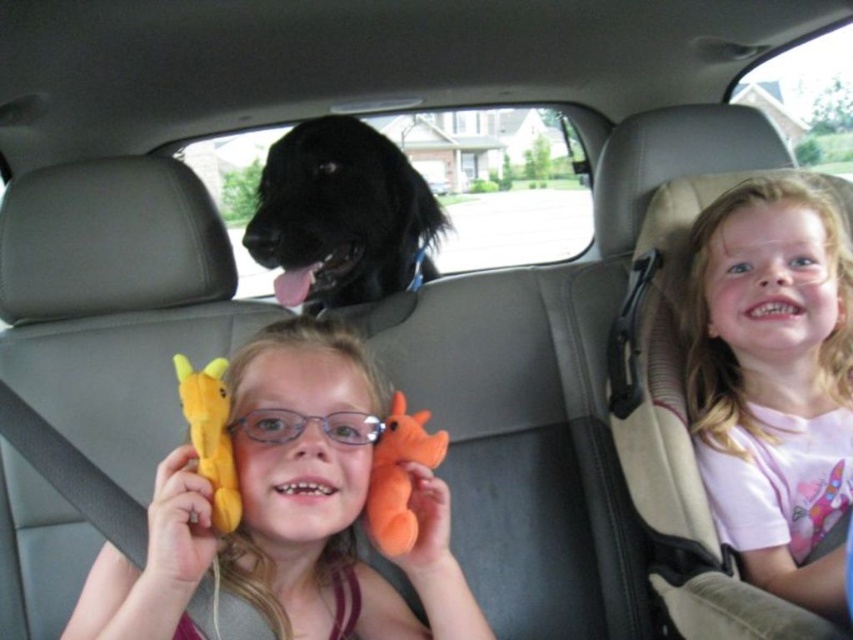
Based on the photo, who is positioned more to the left, soft plush toy at center or black fur dog at center?

From the viewer's perspective, black fur dog at center appears more on the left side.

Does soft plush toy at center have a lesser width compared to black fur dog at center?

In fact, soft plush toy at center might be wider than black fur dog at center.

Is point (370, 426) positioned before point (289, 177)?

Yes, point (370, 426) is closer to viewer.

I want to click on soft plush toy at center, so click(x=286, y=512).

Is soft plush toy at center bigger than pink cotton shirt at upper right?

No.

From the picture: Is soft plush toy at center smaller than pink cotton shirt at upper right?

Yes.

Between point (456, 620) and point (770, 552), which one is positioned behind?

Positioned behind is point (770, 552).

You are a GUI agent. You are given a task and a screenshot of the screen. Output one action in this format:
    pyautogui.click(x=<x>, y=<y>)
    Task: Click on the soft plush toy at center
    The image size is (853, 640).
    Given the screenshot: What is the action you would take?
    pyautogui.click(x=286, y=512)

Can you confirm if black fur dog at center is positioned below yellow plush giraffe at lower left?

Actually, black fur dog at center is above yellow plush giraffe at lower left.

Based on the photo, does black fur dog at center have a greater height compared to yellow plush giraffe at lower left?

Yes, black fur dog at center is taller than yellow plush giraffe at lower left.

Is point (421, 259) positioned after point (225, 525)?

Yes, it is behind point (225, 525).

Where is `black fur dog at center`? The image size is (853, 640). black fur dog at center is located at coordinates (341, 216).